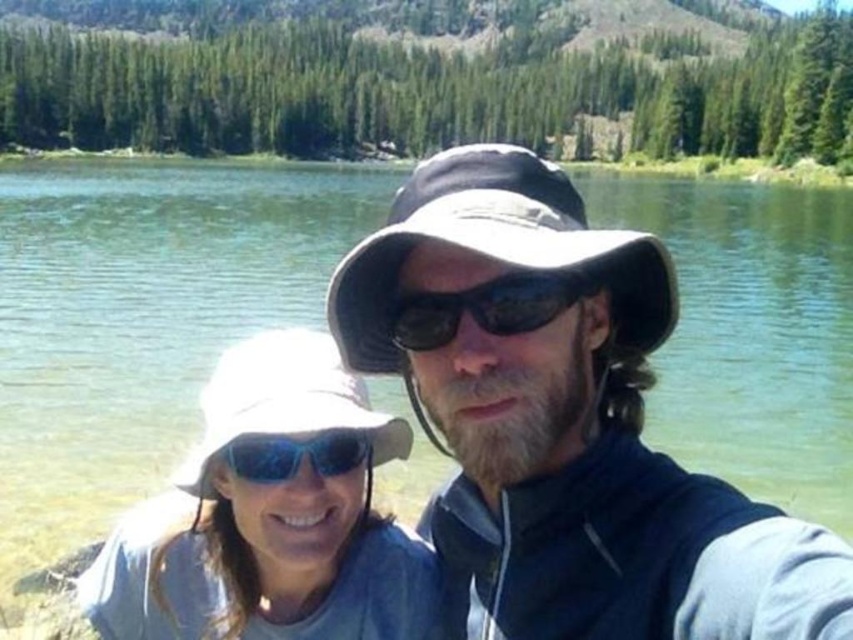
Who is positioned more to the right, matte black hat at center or blue reflective lens goggles at center?

From the viewer's perspective, matte black hat at center appears more on the right side.

Does matte black hat at center have a smaller size compared to blue reflective lens goggles at center?

Incorrect, matte black hat at center is not smaller in size than blue reflective lens goggles at center.

Does point (563, 556) come behind point (328, 433)?

No.

Image resolution: width=853 pixels, height=640 pixels. What are the coordinates of `matte black hat at center` in the screenshot? It's located at (561, 422).

Who is higher up, matte black hat at center or sunglasses at center?

sunglasses at center is above.

Between matte black hat at center and sunglasses at center, which one has more height?

matte black hat at center is taller.

Identify the location of matte black hat at center. (561, 422).

What are the coordinates of `matte black hat at center` in the screenshot? It's located at (561, 422).

Is matte black hat at center smaller than white matte hat at center?

Yes.

Between point (409, 381) and point (358, 419), which one is positioned in front?

Positioned in front is point (358, 419).

Who is more forward, (492, 276) or (273, 368)?

Positioned in front is point (492, 276).

Identify the location of matte black hat at center. (561, 422).